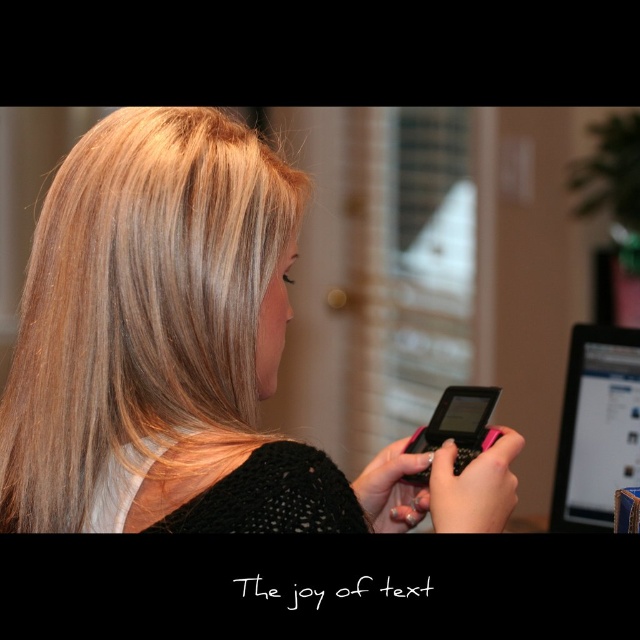
Question: Which object is closer to the camera taking this photo?

Choices:
 (A) black matte text at center
 (B) matte black computer at right

Answer: (A)

Question: Does matte black computer at right come behind pink matte smartphone at center?

Choices:
 (A) yes
 (B) no

Answer: (A)

Question: Is blonde hair at center in front of pink matte smartphone at center?

Choices:
 (A) yes
 (B) no

Answer: (A)

Question: Which of the following is the farthest from the observer?

Choices:
 (A) (173, 426)
 (B) (570, 496)

Answer: (B)

Question: Is blonde hair at center to the right of pink matte smartphone at center from the viewer's perspective?

Choices:
 (A) no
 (B) yes

Answer: (A)

Question: Which is nearer to the black matte text at center?

Choices:
 (A) matte black computer at right
 (B) pink matte smartphone at center
 (C) blonde hair at center

Answer: (C)